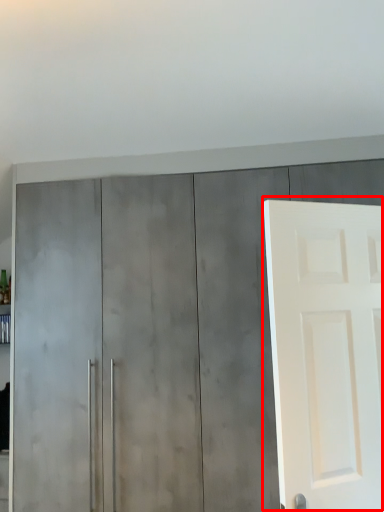
Question: From the image, what is the correct spatial relationship of door (annotated by the red box) in relation to cupboard?

Choices:
 (A) right
 (B) left

Answer: (A)